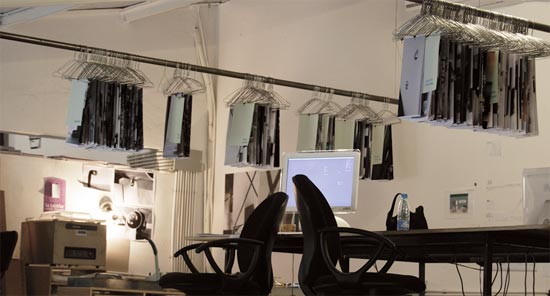
What are the coordinates of `light` in the screenshot? It's located at (131, 220).